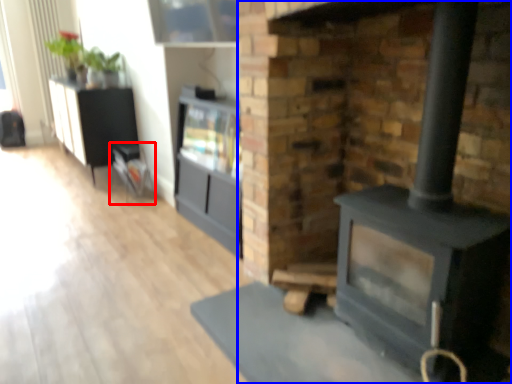
Question: Which object appears farthest to the camera in this image, furniture (highlighted by a red box) or fireplace (highlighted by a blue box)?

Choices:
 (A) furniture
 (B) fireplace

Answer: (A)